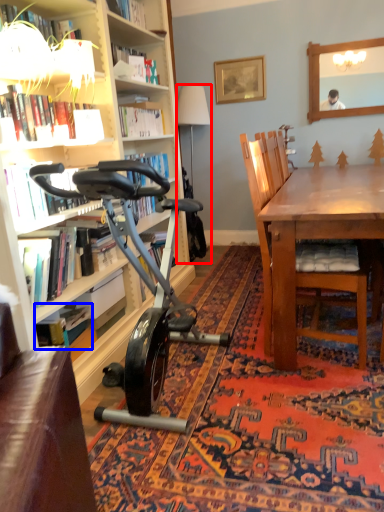
Question: Which object is closer to the camera taking this photo, lamp (highlighted by a red box) or book (highlighted by a blue box)?

Choices:
 (A) lamp
 (B) book

Answer: (B)